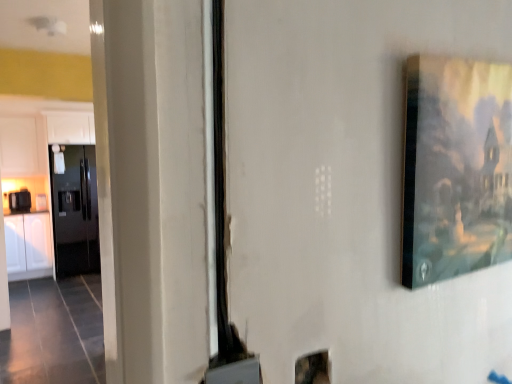
Question: Should I look upward or downward to see black glossy toaster at left?

Choices:
 (A) up
 (B) down

Answer: (B)

Question: From a real-world perspective, does matte wooden picture frame at upper right stand above white matte cabinet at upper left, which ranks as the 1th cabinetry in top-to-bottom order?

Choices:
 (A) no
 (B) yes

Answer: (A)

Question: Considering the relative sizes of matte wooden picture frame at upper right and white matte cabinet at upper left, which ranks as the 1th cabinetry in top-to-bottom order, in the image provided, is matte wooden picture frame at upper right taller than white matte cabinet at upper left, which ranks as the 1th cabinetry in top-to-bottom order,?

Choices:
 (A) no
 (B) yes

Answer: (A)

Question: Can you confirm if matte wooden picture frame at upper right is positioned to the left of white matte cabinet at upper left, acting as the second cabinetry starting from the bottom?

Choices:
 (A) yes
 (B) no

Answer: (B)

Question: Does matte wooden picture frame at upper right have a lesser width compared to white matte cabinet at upper left, acting as the second cabinetry starting from the bottom?

Choices:
 (A) yes
 (B) no

Answer: (A)

Question: Considering the relative sizes of matte wooden picture frame at upper right and white matte cabinet at upper left, acting as the second cabinetry starting from the bottom, in the image provided, is matte wooden picture frame at upper right bigger than white matte cabinet at upper left, acting as the second cabinetry starting from the bottom,?

Choices:
 (A) yes
 (B) no

Answer: (B)

Question: Is matte wooden picture frame at upper right positioned with its back to white matte cabinet at upper left, acting as the second cabinetry starting from the bottom?

Choices:
 (A) no
 (B) yes

Answer: (B)

Question: Does matte wooden picture frame at upper right have a lesser height compared to glossy black refrigerator at left?

Choices:
 (A) no
 (B) yes

Answer: (B)

Question: Is the position of matte wooden picture frame at upper right more distant than that of glossy black refrigerator at left?

Choices:
 (A) no
 (B) yes

Answer: (A)

Question: From the image's perspective, is matte wooden picture frame at upper right on top of glossy black refrigerator at left?

Choices:
 (A) yes
 (B) no

Answer: (A)

Question: Is matte wooden picture frame at upper right to the left of glossy black refrigerator at left from the viewer's perspective?

Choices:
 (A) no
 (B) yes

Answer: (A)

Question: Is matte wooden picture frame at upper right aimed at glossy black refrigerator at left?

Choices:
 (A) no
 (B) yes

Answer: (A)

Question: From the image's perspective, is matte wooden picture frame at upper right below glossy black refrigerator at left?

Choices:
 (A) yes
 (B) no

Answer: (B)

Question: Can you see glossy black refrigerator at left touching black glossy toaster at left?

Choices:
 (A) no
 (B) yes

Answer: (A)